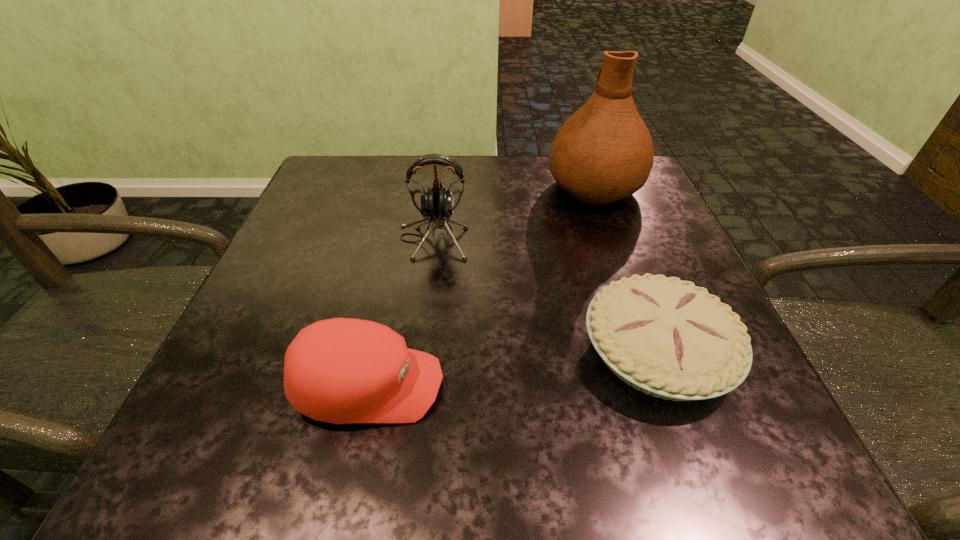
Locate an element on the screen. free area in between the third shortest object and the third tallest object is located at coordinates (401, 313).

Where is `free space between the pie and the second farthest object`? free space between the pie and the second farthest object is located at coordinates (545, 295).

Image resolution: width=960 pixels, height=540 pixels. Identify the location of blank region between the pie and the third tallest object. (513, 369).

Where is `free space between the shortest object and the second farthest object`? free space between the shortest object and the second farthest object is located at coordinates tap(545, 295).

Locate an element on the screen. vacant area that lies between the farthest object and the shortest object is located at coordinates (626, 269).

Choose which object is the second nearest neighbor to the shortest object. Please provide its 2D coordinates. Your answer should be formatted as a tuple, i.e. [(x, y)], where the tuple contains the x and y coordinates of a point satisfying the conditions above.

[(342, 370)]

Find the location of `object that is the second closest to the third tallest object`. object that is the second closest to the third tallest object is located at coordinates (668, 338).

Where is `free location that satisfies the following two spatial constraints: 1. on the front side of the third shortest object; 2. on the front-facing side of the cap`? This screenshot has width=960, height=540. free location that satisfies the following two spatial constraints: 1. on the front side of the third shortest object; 2. on the front-facing side of the cap is located at coordinates (415, 386).